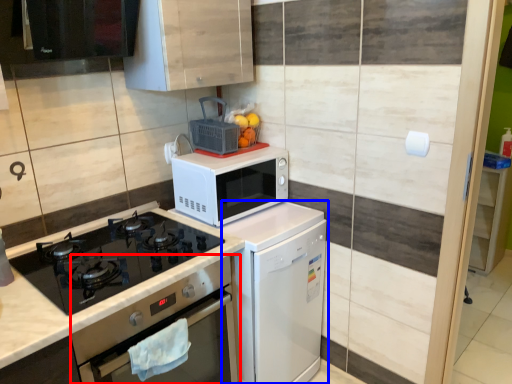
Question: Which point is closer to the camera, oven (highlighted by a red box) or dish washer (highlighted by a blue box)?

Choices:
 (A) oven
 (B) dish washer

Answer: (A)